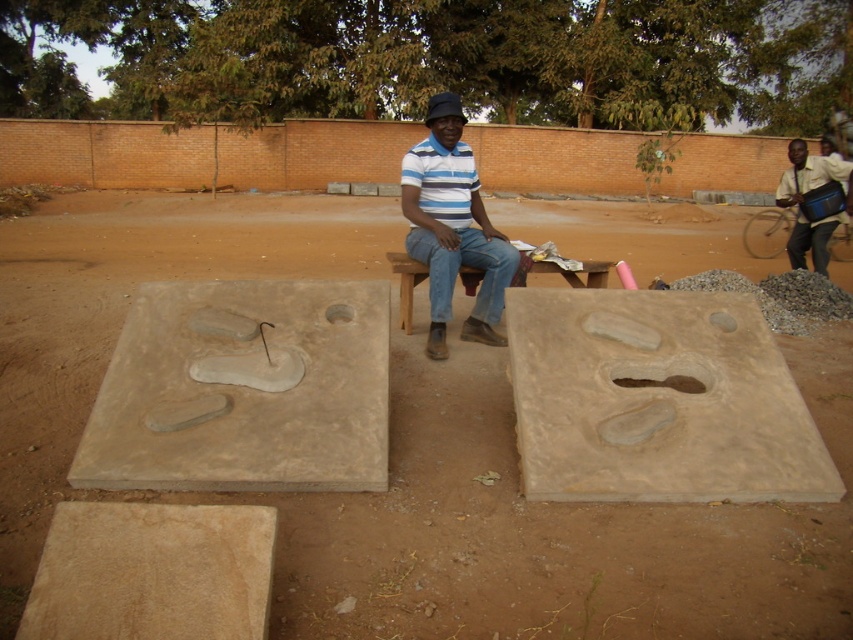
Does beige concrete slab at lower left appear under light brown leather bag at right?

Correct, beige concrete slab at lower left is located below light brown leather bag at right.

Measure the distance between beige concrete slab at lower left and light brown leather bag at right.

21.26 feet

Describe the element at coordinates (152, 572) in the screenshot. I see `beige concrete slab at lower left` at that location.

Locate an element on the screen. beige concrete slab at lower left is located at coordinates (152, 572).

Is point (563, 378) farther from camera compared to point (775, 193)?

No.

Can you confirm if brown concrete slab at center is bigger than light brown leather bag at right?

Actually, brown concrete slab at center might be smaller than light brown leather bag at right.

Identify the location of brown concrete slab at center. (657, 401).

Find the location of a particular element. The width and height of the screenshot is (853, 640). brown concrete slab at center is located at coordinates (657, 401).

Does brown dirt field at center have a greater width compared to matte striped shirt at center?

Correct, the width of brown dirt field at center exceeds that of matte striped shirt at center.

Between point (328, 634) and point (440, 253), which one is positioned behind?

The point (440, 253) is behind.

Is point (64, 209) closer to viewer compared to point (422, 195)?

No, (64, 209) is further to viewer.

At what (x,y) coordinates should I click in order to perform the action: click on brown dirt field at center. Please return your answer as a coordinate pair (x, y). Image resolution: width=853 pixels, height=640 pixels. Looking at the image, I should click on (399, 452).